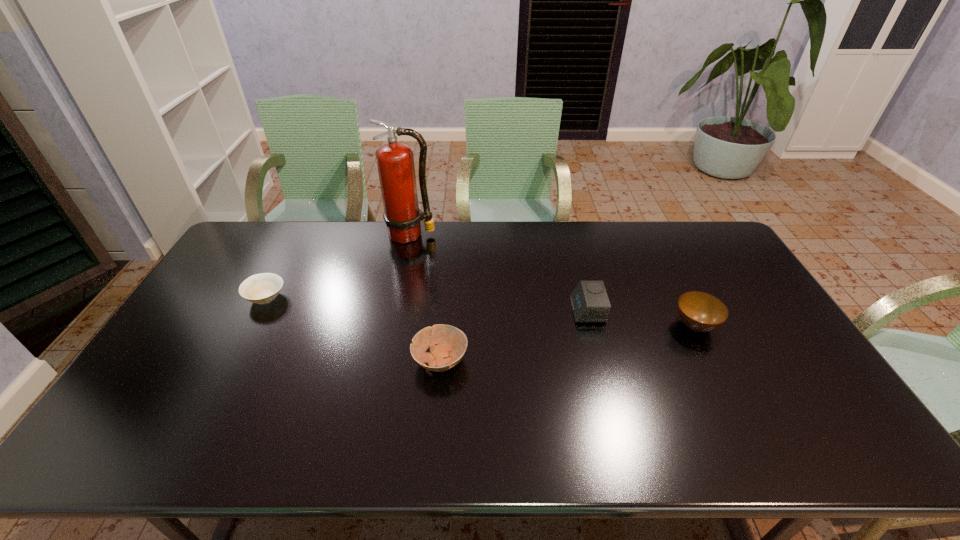
The height and width of the screenshot is (540, 960). Identify the location of free location located on the front-facing side of the alarm clock. (496, 310).

Identify the location of vacant space located on the front of the rightmost bowl. This screenshot has height=540, width=960. (719, 374).

Find the location of a particular element. The image size is (960, 540). free space located on the back of the second bowl from right to left is located at coordinates (449, 260).

This screenshot has width=960, height=540. I want to click on vacant space positioned 0.340m on the right of the shortest bowl, so click(x=395, y=298).

You are a GUI agent. You are given a task and a screenshot of the screen. Output one action in this format:
    pyautogui.click(x=<x>, y=<y>)
    Task: Click on the object that is positioned at the far edge
    The image size is (960, 540).
    Given the screenshot: What is the action you would take?
    pyautogui.click(x=395, y=161)

What are the coordinates of `object situated at the left edge` in the screenshot? It's located at (262, 288).

In the image, there is a desktop. At what (x,y) coordinates should I click in order to perform the action: click on blank space at the far edge. Please return your answer as a coordinate pair (x, y). The height and width of the screenshot is (540, 960). Looking at the image, I should click on pos(372,246).

Image resolution: width=960 pixels, height=540 pixels. Find the location of `free space at the near edge of the desktop`. free space at the near edge of the desktop is located at coordinates (228, 434).

This screenshot has width=960, height=540. What are the coordinates of `vacant space at the left edge of the desktop` in the screenshot? It's located at (202, 334).

Identify the location of vacant space at the right edge. (728, 280).